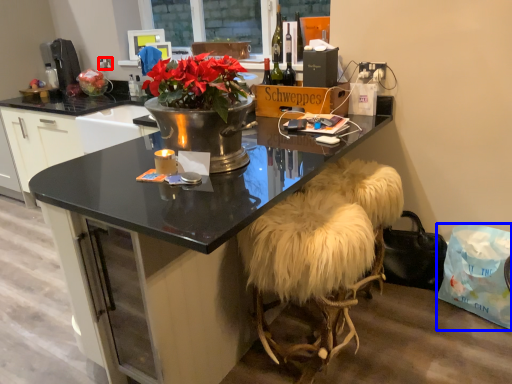
Question: Among these objects, which one is nearest to the camera, power outlet (highlighted by a red box) or handbag (highlighted by a blue box)?

Choices:
 (A) power outlet
 (B) handbag

Answer: (B)